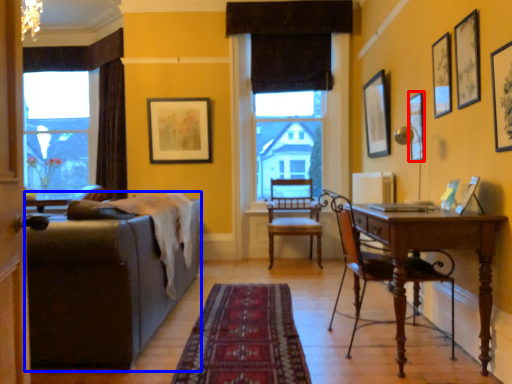
Question: Which point is closer to the camera, picture frame (highlighted by a red box) or studio couch (highlighted by a blue box)?

Choices:
 (A) picture frame
 (B) studio couch

Answer: (B)